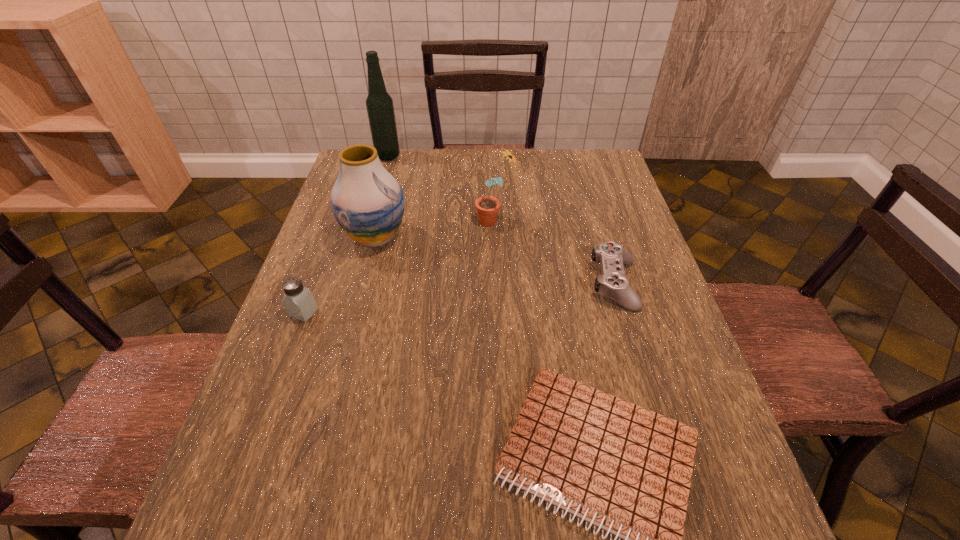
What are the coordinates of `vacant space located 0.270m on the flower of the sunflower` in the screenshot? It's located at (381, 220).

Identify the location of free space located 0.330m on the back of the third shortest object. (339, 218).

This screenshot has width=960, height=540. What are the coordinates of `free point located 0.180m on the front of the control` in the screenshot? It's located at (643, 380).

The width and height of the screenshot is (960, 540). Find the location of `object situated at the far edge`. object situated at the far edge is located at coordinates (379, 104).

Find the location of a particular element. This screenshot has height=540, width=960. alcohol at the left edge is located at coordinates (379, 104).

Identify the location of vase that is at the left edge. click(367, 202).

Image resolution: width=960 pixels, height=540 pixels. Identify the location of saltshaker present at the left edge. (299, 302).

This screenshot has height=540, width=960. Find the location of `object present at the right edge`. object present at the right edge is located at coordinates (613, 284).

The image size is (960, 540). I want to click on object located at the far left corner, so click(379, 104).

Locate an element on the screen. Image resolution: width=960 pixels, height=540 pixels. free space at the far edge is located at coordinates (420, 176).